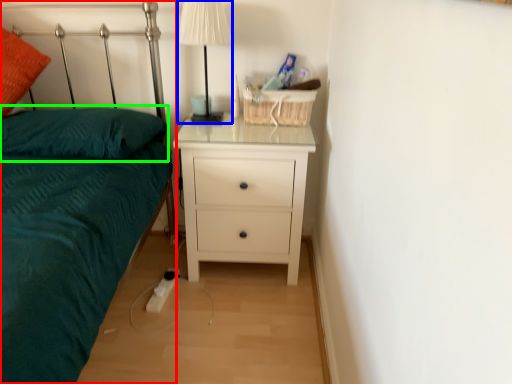
Question: Based on their relative distances, which object is nearer to bed (highlighted by a red box)? Choose from table lamp (highlighted by a blue box) and pillow (highlighted by a green box).

Choices:
 (A) table lamp
 (B) pillow

Answer: (B)